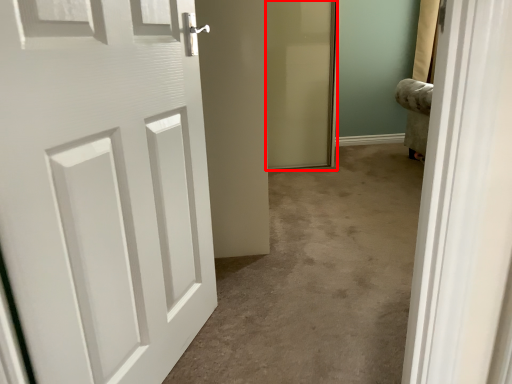
Question: From the image's perspective, where is screen door (annotated by the red box) located in relation to door in the image?

Choices:
 (A) above
 (B) below

Answer: (A)